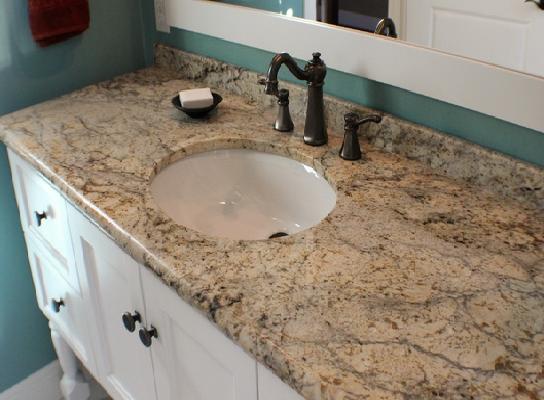
The image size is (544, 400). I want to click on handles, so point(368,117), point(285,96), point(41,218), point(54,306), point(123,319), point(142,340).